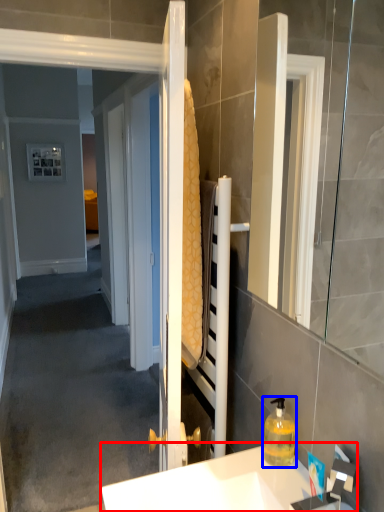
Question: Which object appears closest to the camera in this image, sink (highlighted by a red box) or bottle (highlighted by a blue box)?

Choices:
 (A) sink
 (B) bottle

Answer: (A)